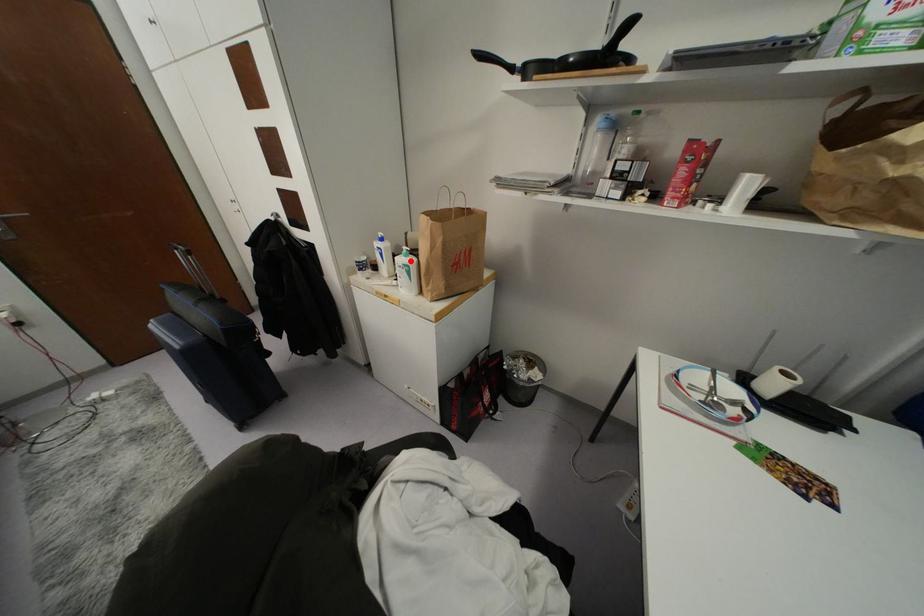
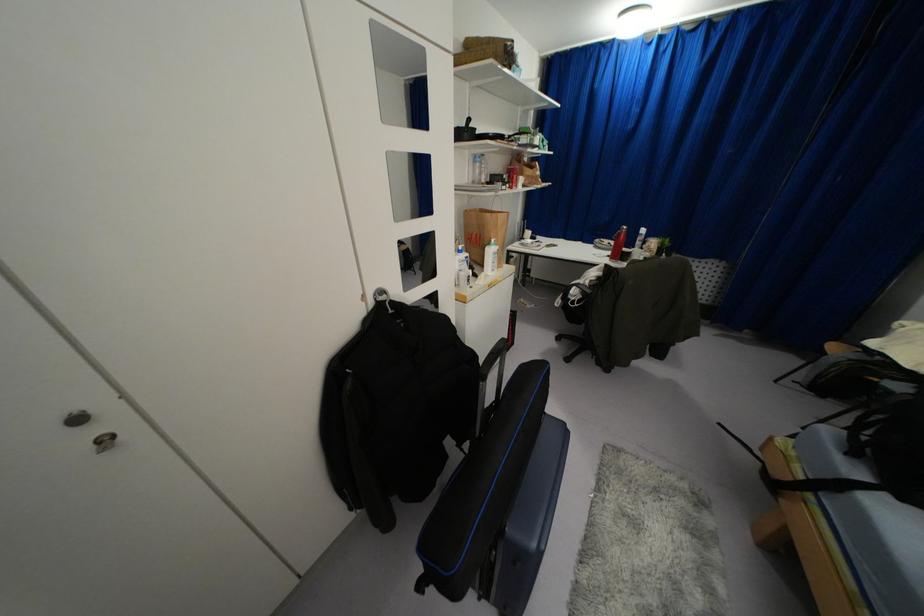
Question: I am providing you with two images of the same scene from different viewpoints. Image1 has a red point marked. In image2, the corresponding 3D location appears at what relative position? Reply with the corresponding letter.

Choices:
 (A) Closer
 (B) Farther

Answer: (A)